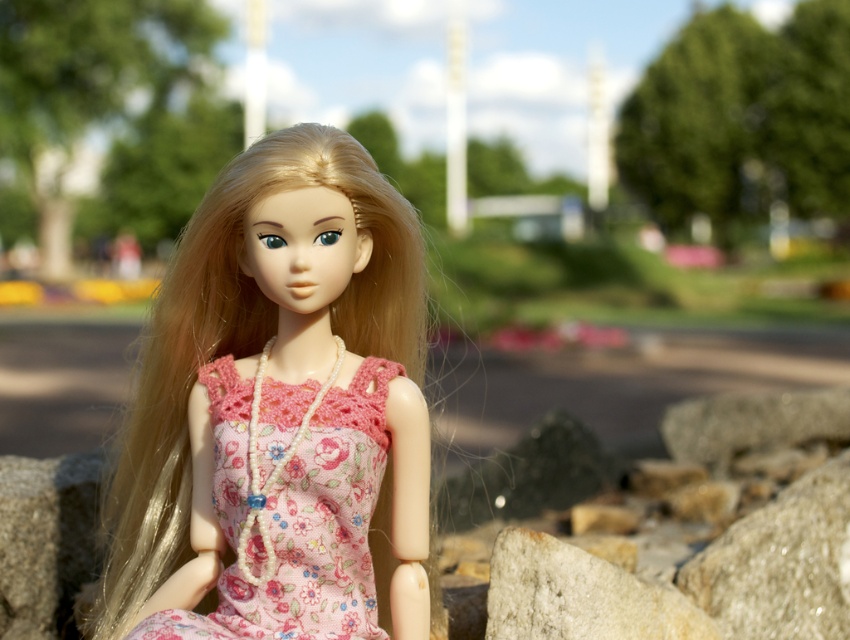
Based on the photo, can you confirm if pink fabric dress at center is positioned to the right of floral fabric dress at center?

Incorrect, pink fabric dress at center is not on the right side of floral fabric dress at center.

Which is more to the left, pink fabric dress at center or floral fabric dress at center?

pink fabric dress at center

What do you see at coordinates (272, 356) in the screenshot? Image resolution: width=850 pixels, height=640 pixels. I see `pink fabric dress at center` at bounding box center [272, 356].

Locate an element on the screen. pink fabric dress at center is located at coordinates (272, 356).

Who is positioned more to the left, pink fabric dress at center or gray rough stone at center?

pink fabric dress at center

Is pink fabric dress at center below gray rough stone at center?

Actually, pink fabric dress at center is above gray rough stone at center.

Who is more forward, (295, 550) or (607, 602)?

Point (295, 550)

At what (x,y) coordinates should I click in order to perform the action: click on pink fabric dress at center. Please return your answer as a coordinate pair (x, y). This screenshot has width=850, height=640. Looking at the image, I should click on (272, 356).

Does gray rough stone at lower right have a smaller size compared to gray granite stone at lower left?

No, gray rough stone at lower right is not smaller than gray granite stone at lower left.

Does gray rough stone at lower right appear on the left side of gray granite stone at lower left?

No, gray rough stone at lower right is not to the left of gray granite stone at lower left.

Locate an element on the screen. gray rough stone at lower right is located at coordinates (782, 563).